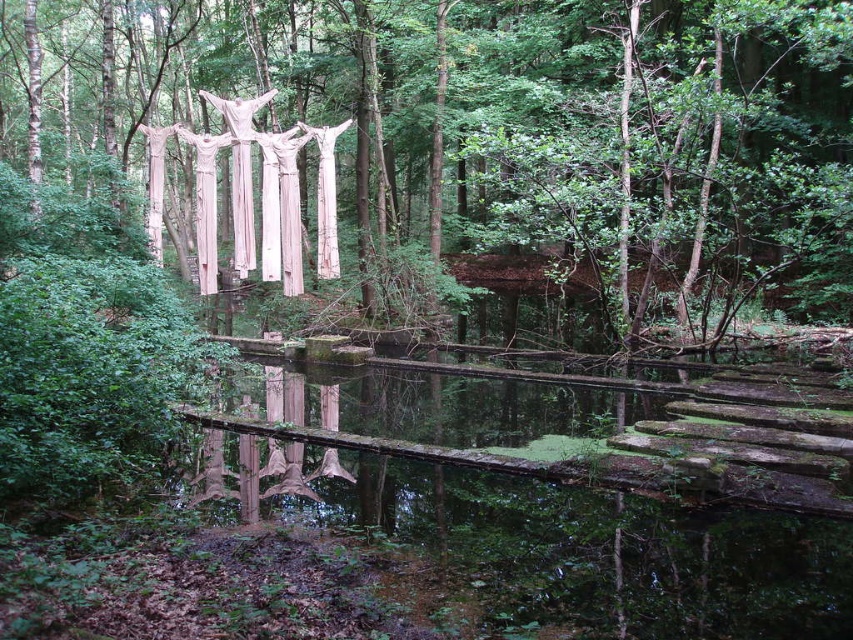
Question: Among these objects, which one is farthest from the camera?

Choices:
 (A) smooth white sculpture at center
 (B) green mossy water at center

Answer: (A)

Question: Can you confirm if smooth white sculpture at center is positioned below green mossy water at center?

Choices:
 (A) yes
 (B) no

Answer: (B)

Question: Does smooth white sculpture at center appear over green mossy water at center?

Choices:
 (A) no
 (B) yes

Answer: (B)

Question: Does smooth white sculpture at center have a larger size compared to green mossy water at center?

Choices:
 (A) no
 (B) yes

Answer: (B)

Question: Which of the following is the farthest from the observer?

Choices:
 (A) smooth white sculpture at center
 (B) green mossy water at center

Answer: (A)

Question: Which point is closer to the camera?

Choices:
 (A) green mossy water at center
 (B) smooth white sculpture at center

Answer: (A)